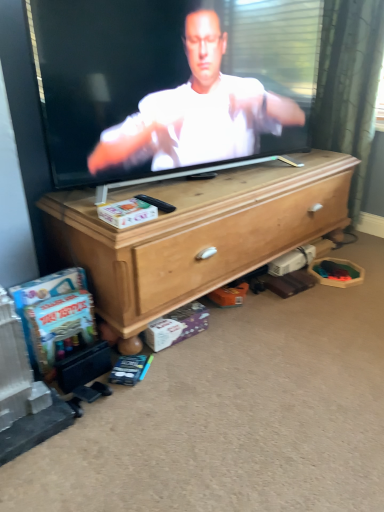
Image resolution: width=384 pixels, height=512 pixels. I want to click on free spot below smooth white shirt at center (from a real-world perspective), so click(191, 185).